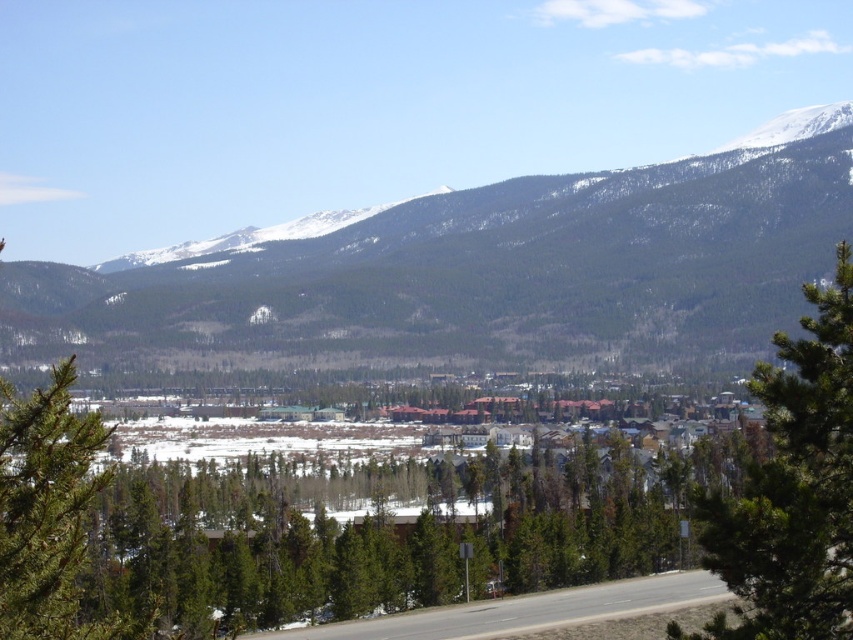
Does point (752, 576) come behind point (328, 625)?

No.

Is green textured tree at center-right positioned at the back of gray asphalt road at center?

No, green textured tree at center-right is in front of gray asphalt road at center.

Is point (792, 500) farther from viewer compared to point (540, 604)?

No, it is not.

Where is `green textured tree at center-right`? green textured tree at center-right is located at coordinates (792, 488).

Which of these two, snowy forested mountain at upper center or gray asphalt road at center, stands taller?

Standing taller between the two is snowy forested mountain at upper center.

Which is more to the left, snowy forested mountain at upper center or gray asphalt road at center?

gray asphalt road at center

Who is more forward, (779, 273) or (492, 620)?

Positioned in front is point (492, 620).

Identify the location of snowy forested mountain at upper center. The image size is (853, 640). (x=480, y=268).

Does point (526, 218) lie in front of point (756, 538)?

No, it is not.

Who is more forward, (396, 234) or (796, 406)?

Point (796, 406) is more forward.

Find the location of a particular element. snowy forested mountain at upper center is located at coordinates (480, 268).